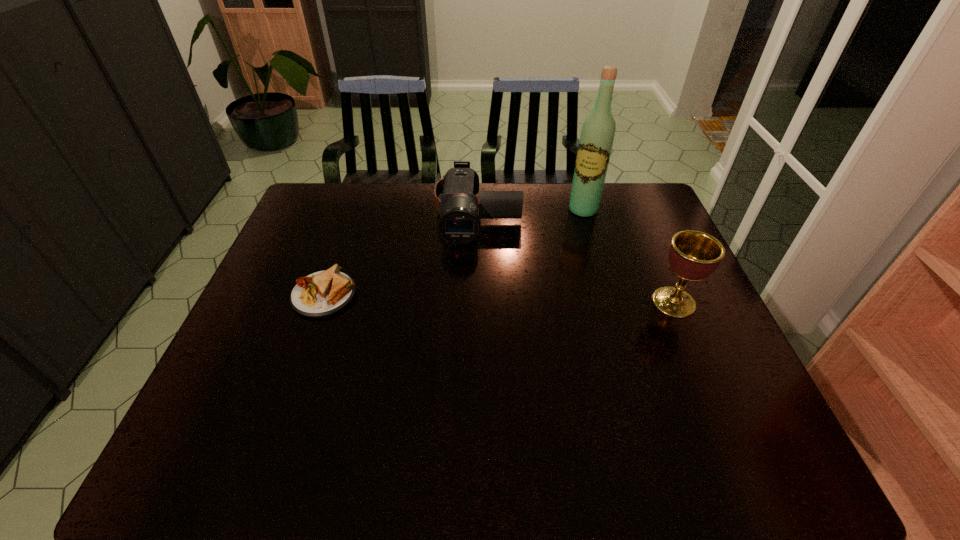
Where is `free location at the far edge`? free location at the far edge is located at coordinates (425, 190).

Where is `free region at the near edge of the desktop`? This screenshot has height=540, width=960. free region at the near edge of the desktop is located at coordinates (321, 385).

In the image, there is a desktop. Where is `vacant region at the left edge`? vacant region at the left edge is located at coordinates (251, 309).

In the image, there is a desktop. Identify the location of vacant space at the right edge. (634, 268).

I want to click on vacant region at the far left corner of the desktop, so click(336, 197).

Locate an element on the screen. free area in between the tallest object and the second shortest object is located at coordinates (531, 212).

Identify the location of free spot between the tallest object and the camcorder. This screenshot has width=960, height=540. (531, 212).

This screenshot has height=540, width=960. In order to click on free space between the third object from right to left and the third object from left to right in this screenshot , I will do `click(531, 212)`.

Image resolution: width=960 pixels, height=540 pixels. Identify the location of free point between the sandwich and the second shortest object. (401, 254).

Where is `free area in between the shortest object and the camcorder`? The image size is (960, 540). free area in between the shortest object and the camcorder is located at coordinates (401, 254).